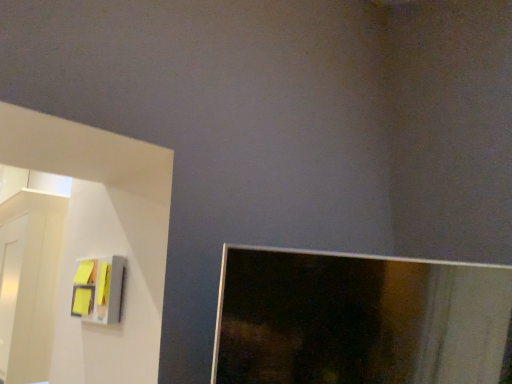
Locate an element on the screen. Image resolution: width=512 pixels, height=384 pixels. yellow matte sticky notes at left is located at coordinates (98, 290).

What is the approximate height of yellow matte sticky notes at left?

The height of yellow matte sticky notes at left is 8.46 inches.

Measure the distance between yellow matte sticky notes at left and camera.

They are 4.19 feet apart.

Describe the element at coordinates (98, 290) in the screenshot. I see `yellow matte sticky notes at left` at that location.

The image size is (512, 384). What are the coordinates of `yellow matte sticky notes at left` in the screenshot? It's located at (98, 290).